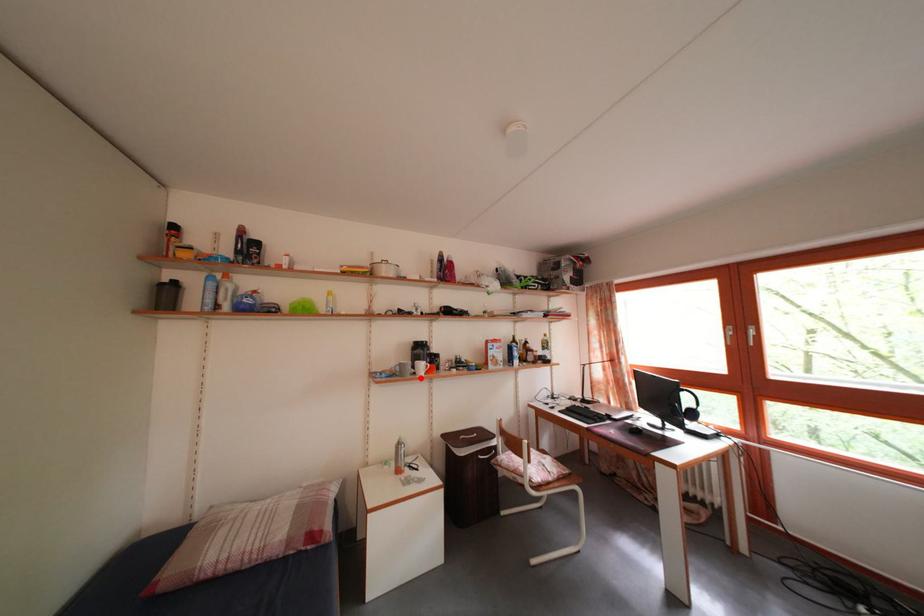
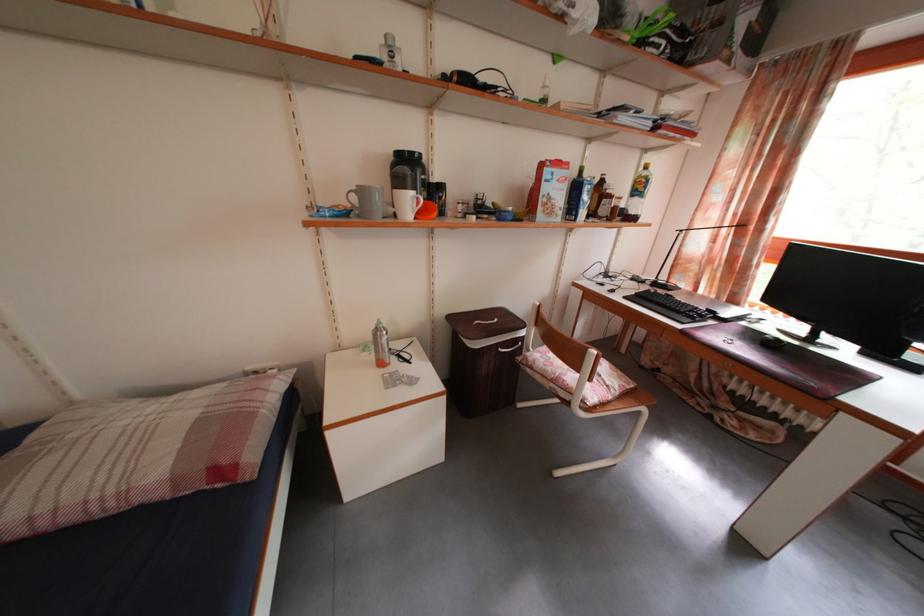
In the second image, find the point that corresponds to the highlighted location in the first image.

(398, 217)